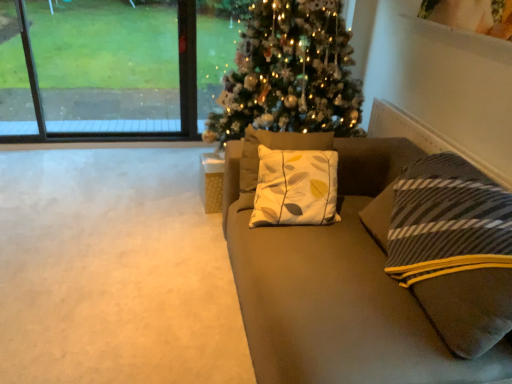
Question: Do you think wooden cube at center is within suede couch at center, or outside of it?

Choices:
 (A) inside
 (B) outside

Answer: (B)

Question: Is wooden cube at center to the left or to the right of suede couch at center in the image?

Choices:
 (A) left
 (B) right

Answer: (A)

Question: Considering the real-world distances, which object is closest to the transparent glass window at upper left?

Choices:
 (A) suede couch at center
 (B) iridescent glass christmas tree at center
 (C) wooden cube at center

Answer: (B)

Question: Estimate the real-world distances between objects in this image. Which object is closer to the iridescent glass christmas tree at center?

Choices:
 (A) suede couch at center
 (B) transparent glass window at upper left
 (C) wooden cube at center

Answer: (C)